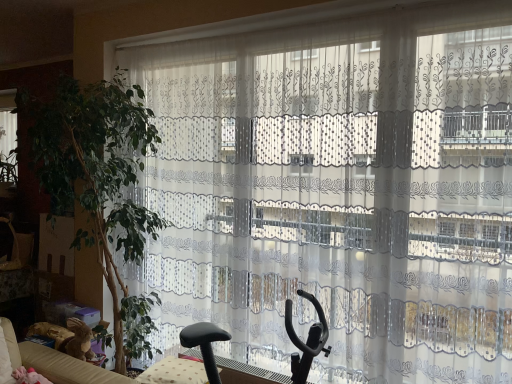
Question: From a real-world perspective, is transparent lace curtain at left on green leafy plant at left?

Choices:
 (A) no
 (B) yes

Answer: (B)

Question: Can you confirm if transparent lace curtain at left is thinner than green leafy plant at left?

Choices:
 (A) yes
 (B) no

Answer: (A)

Question: Is transparent lace curtain at left wider than green leafy plant at left?

Choices:
 (A) no
 (B) yes

Answer: (A)

Question: Is transparent lace curtain at left positioned in front of green leafy plant at left?

Choices:
 (A) yes
 (B) no

Answer: (B)

Question: Are transparent lace curtain at left and green leafy plant at left located far from each other?

Choices:
 (A) no
 (B) yes

Answer: (B)

Question: From the image's perspective, is transparent lace curtain at left on green leafy plant at left?

Choices:
 (A) yes
 (B) no

Answer: (A)

Question: Can you confirm if green leafy plant at left is taller than black plastic swivel chair at center?

Choices:
 (A) no
 (B) yes

Answer: (B)

Question: Does green leafy plant at left have a smaller size compared to black plastic swivel chair at center?

Choices:
 (A) no
 (B) yes

Answer: (A)

Question: From a real-world perspective, is green leafy plant at left on black plastic swivel chair at center?

Choices:
 (A) no
 (B) yes

Answer: (B)

Question: Is green leafy plant at left bigger than black plastic swivel chair at center?

Choices:
 (A) yes
 (B) no

Answer: (A)

Question: Is there a large distance between green leafy plant at left and black plastic swivel chair at center?

Choices:
 (A) no
 (B) yes

Answer: (B)

Question: Are green leafy plant at left and black plastic swivel chair at center beside each other?

Choices:
 (A) no
 (B) yes

Answer: (A)

Question: From a real-world perspective, is green leafy plant at left under transparent lace curtain at left?

Choices:
 (A) yes
 (B) no

Answer: (A)